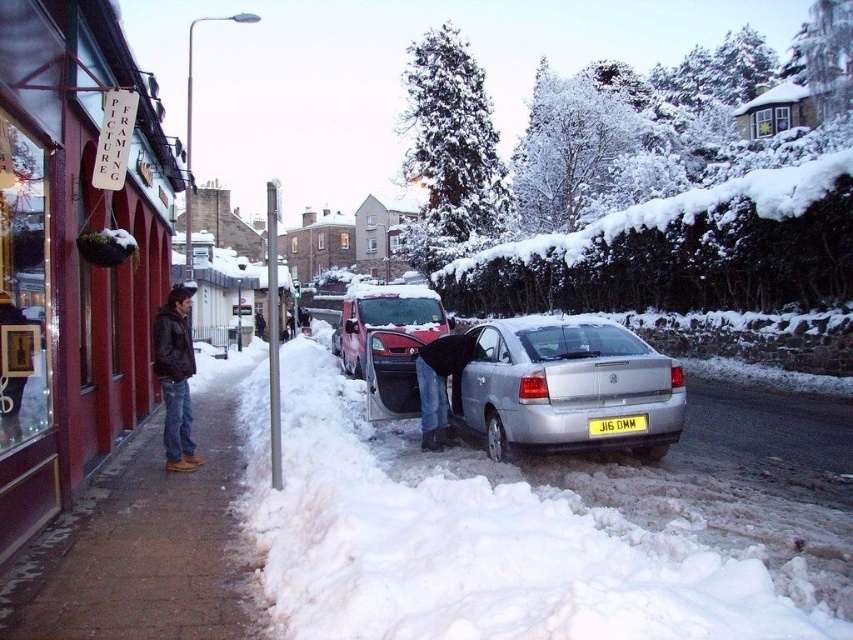
You are a delivery person who needs to park your delivery van. You see the white fluffy snow at lower center and the metallic red van at center. Which area is more suitable for parking your van?

The metallic red van at center is larger than the white fluffy snow at lower center, so parking the van there would be more suitable as it can accommodate the van size.

You are a delivery driver who needs to park your metallic red van at center near the white fluffy snow at lower center. Based on the scene, can you park the van so that it is directly in front of the snow?

The white fluffy snow at lower center is to the right of metallic red van at center, so parking the van directly in front of the snow would require positioning it to the right side of the current location of the metallic red van at center.

You are a delivery driver who needs to deliver a package to the red building with the PICTURE FRAMING sign. You have a large box that is 1 meter wide. There is a dark brown leather jacket at left and a yellow matte license plate at center in your path. Can your box fit through the space between them?

The dark brown leather jacket at left is bigger than the yellow matte license plate at center. Since the box is 1 meter wide, it depends on the actual distance between them. However, the description only states their size comparison, not the distance. Therefore, we cannot determine if the box will fit based on the given information.